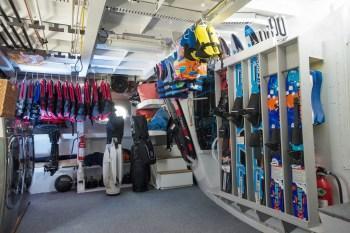
Locate an element on the screen. The image size is (350, 233). floor is located at coordinates (101, 224).